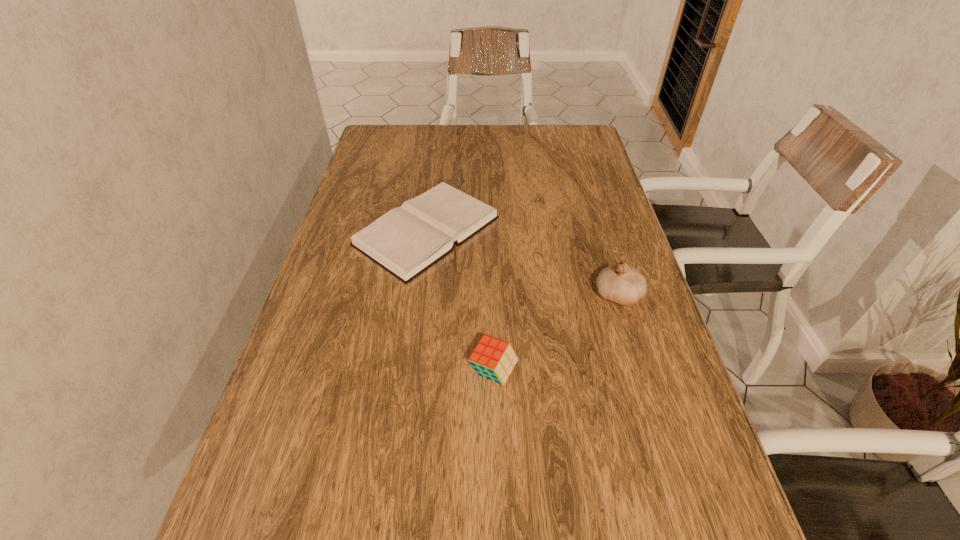
I want to click on free space at the far edge of the desktop, so click(495, 141).

At what (x,y) coordinates should I click in order to perform the action: click on free location at the left edge. Please return your answer as a coordinate pair (x, y). This screenshot has width=960, height=540. Looking at the image, I should click on (360, 293).

This screenshot has height=540, width=960. In the image, there is a desktop. In order to click on vacant space at the right edge in this screenshot , I will do `click(689, 425)`.

Locate an element on the screen. unoccupied position between the tallest object and the cube is located at coordinates (555, 333).

What are the coordinates of `free space that is in between the shortest object and the second shortest object` in the screenshot? It's located at (460, 301).

Image resolution: width=960 pixels, height=540 pixels. I want to click on vacant space that is in between the nearest object and the shortest object, so click(x=460, y=301).

Locate an element on the screen. The image size is (960, 540). vacant space in between the rightmost object and the shortest object is located at coordinates (522, 262).

Identify the location of free space between the cube and the shortest object. (460, 301).

This screenshot has height=540, width=960. In order to click on vacant space that's between the hardback book and the nearest object in this screenshot , I will do `click(460, 301)`.

This screenshot has height=540, width=960. Find the location of `vacant space that is in between the cube and the rightmost object`. vacant space that is in between the cube and the rightmost object is located at coordinates (555, 333).